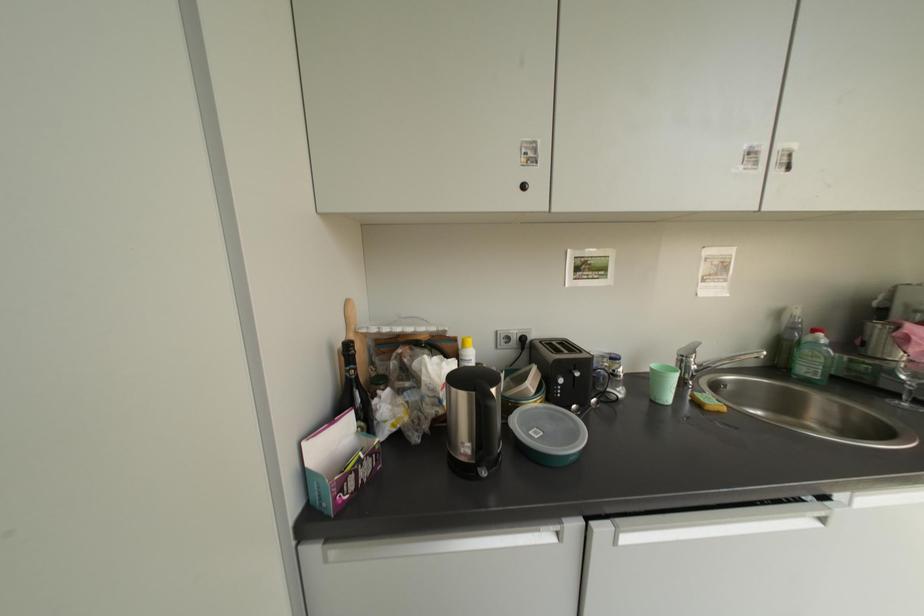
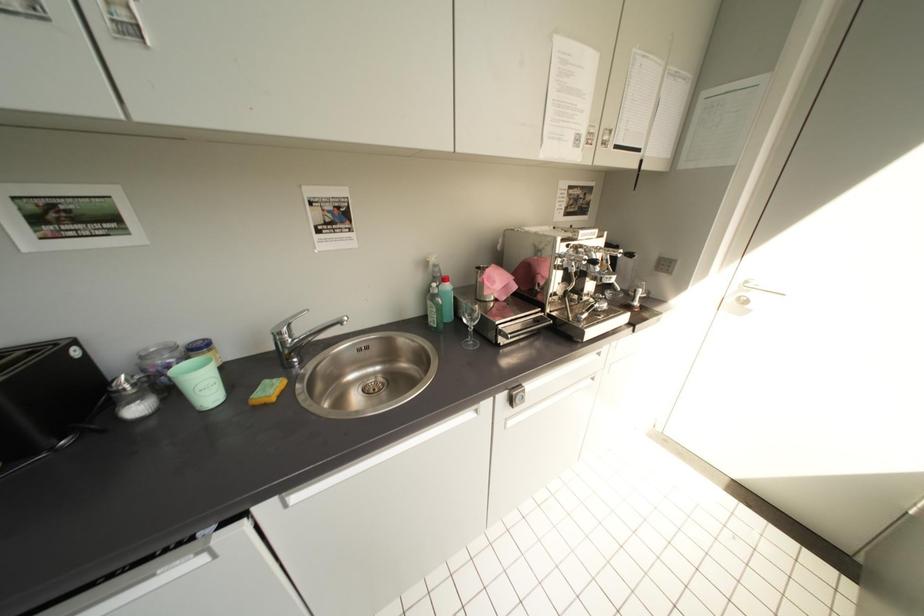
Question: The images are taken continuously from a first-person perspective. In which direction are you moving?

Choices:
 (A) Left
 (B) Right
 (C) Forward
 (D) Backward

Answer: (B)